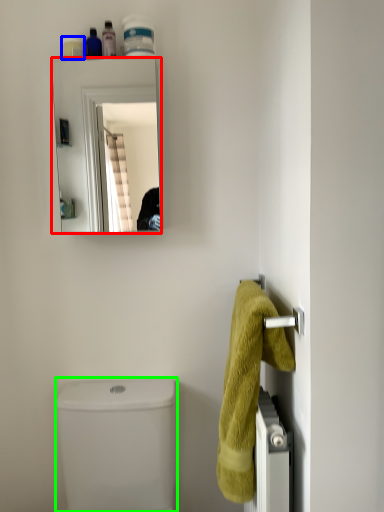
Question: Based on their relative distances, which object is farther from mirror (highlighted by a red box)? Choose from toiletry (highlighted by a blue box) and toilet bowl (highlighted by a green box).

Choices:
 (A) toiletry
 (B) toilet bowl

Answer: (A)